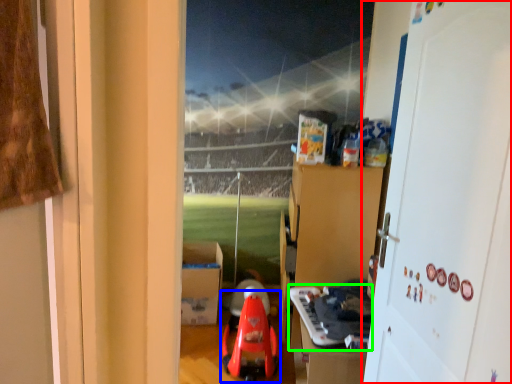
Question: Estimate the real-world distances between objects in this image. Which object is farther from door (highlighted by a red box), toy (highlighted by a blue box) or toy (highlighted by a green box)?

Choices:
 (A) toy
 (B) toy

Answer: (A)